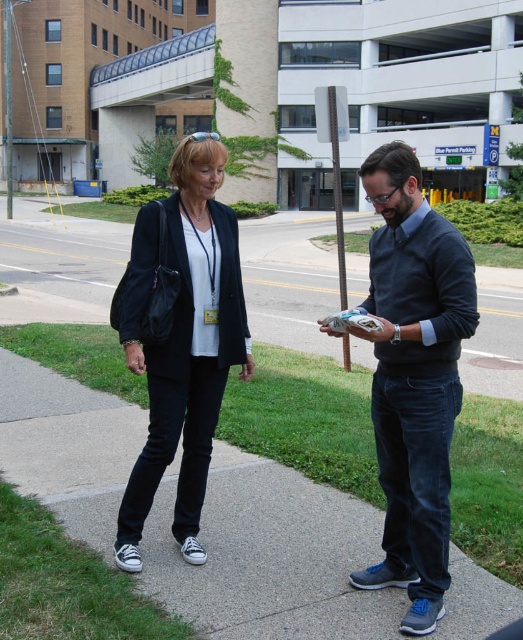
What do you see at coordinates (414, 378) in the screenshot? I see `dark blue jeans at center` at bounding box center [414, 378].

Which is in front, point (425, 538) or point (210, 289)?

Positioned in front is point (425, 538).

Who is more forward, [221,388] or [145,273]?

Positioned in front is point [145,273].

At what (x,y) coordinates should I click in order to perform the action: click on dark blue jeans at center. Please return your answer as a coordinate pair (x, y). Looking at the image, I should click on (414, 378).

Is dark blue jeans at center positioned in front of dark blue sweater at center?

Yes, it is.

Who is more forward, (x=401, y=577) or (x=403, y=208)?

Point (x=403, y=208)

Identify the location of dark blue jeans at center. 414,378.

Is dark blue sweater at center wider than black canvas sneakers at lower left?

Correct, the width of dark blue sweater at center exceeds that of black canvas sneakers at lower left.

Is point (374, 160) farther from viewer compared to point (234, 356)?

That is False.

Locate an element on the screen. Image resolution: width=523 pixels, height=640 pixels. dark blue sweater at center is located at coordinates (414, 378).